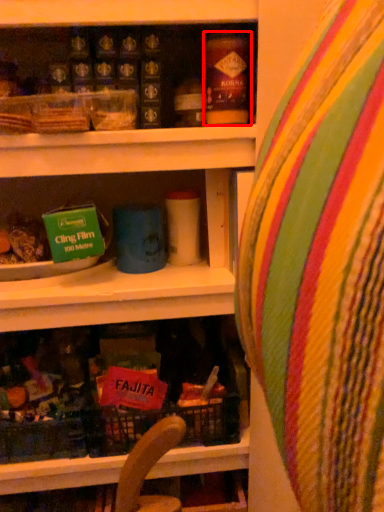
Question: From the image's perspective, where is yoghurt (annotated by the red box) located in relation to bean bag chair in the image?

Choices:
 (A) above
 (B) below

Answer: (A)